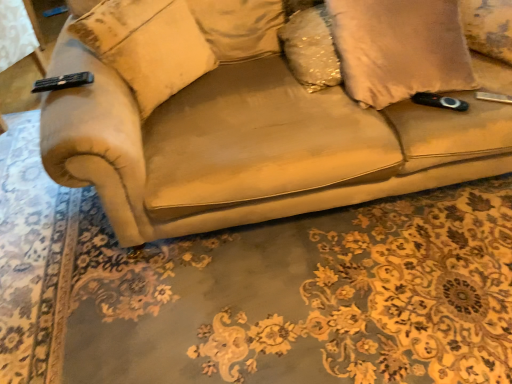
Question: Is suede-like beige pillow at right, which is counted as the second pillow, starting from the right, bigger or smaller than suede-like beige pillow at upper right, which ranks as the 1th pillow in right-to-left order?

Choices:
 (A) small
 (B) big

Answer: (B)

Question: Is suede-like beige pillow at right, positioned as the 3th pillow in left-to-right order, inside the boundaries of suede-like beige pillow at upper right, which ranks as the 1th pillow in right-to-left order, or outside?

Choices:
 (A) outside
 (B) inside

Answer: (A)

Question: Considering the real-world distances, which object is closest to the suede-like beige pillow at upper right, which ranks as the 1th pillow in right-to-left order?

Choices:
 (A) sparkly gold pillow at upper center, the second pillow positioned from the left
 (B) suede-like beige pillow at right, which is counted as the second pillow, starting from the right
 (C) beige fabric pillow at left, which is the first pillow in left-to-right order

Answer: (B)

Question: Considering the real-world distances, which object is farthest from the beige fabric pillow at left, positioned as the fourth pillow in right-to-left order?

Choices:
 (A) suede-like beige pillow at upper right, which ranks as the 1th pillow in right-to-left order
 (B) suede-like beige pillow at right, positioned as the 3th pillow in left-to-right order
 (C) sparkly gold pillow at upper center, which ranks as the third pillow in right-to-left order

Answer: (A)